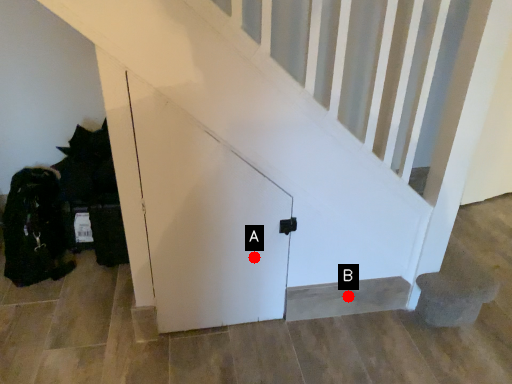
Question: Two points are circled on the image, labeled by A and B beside each circle. Which point is further to the camera?

Choices:
 (A) A is further
 (B) B is further

Answer: (B)